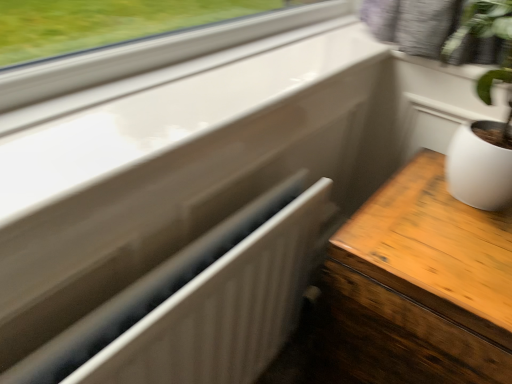
Identify the location of free space above white matte radiator at center (from a real-world perspective). This screenshot has width=512, height=384. (195, 263).